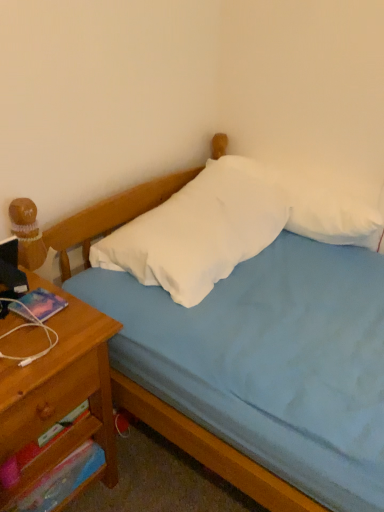
Question: From the image's perspective, is wooden drawer at left, the second drawer when ordered from bottom to top, below light blue fabric bed at center?

Choices:
 (A) no
 (B) yes

Answer: (B)

Question: Is light blue fabric bed at center inside wooden drawer at left, acting as the first drawer starting from the top?

Choices:
 (A) no
 (B) yes

Answer: (A)

Question: Is wooden drawer at left, the second drawer when ordered from bottom to top, beside light blue fabric bed at center?

Choices:
 (A) no
 (B) yes

Answer: (A)

Question: Is the depth of wooden drawer at left, the second drawer when ordered from bottom to top, less than that of light blue fabric bed at center?

Choices:
 (A) yes
 (B) no

Answer: (B)

Question: Is wooden drawer at left, acting as the first drawer starting from the top, shorter than light blue fabric bed at center?

Choices:
 (A) yes
 (B) no

Answer: (A)

Question: Does point (43, 388) appear closer or farther from the camera than point (87, 338)?

Choices:
 (A) closer
 (B) farther

Answer: (A)

Question: Considering their positions, is wooden drawer at left, the second drawer when ordered from bottom to top, located in front of or behind wooden nightstand at left?

Choices:
 (A) front
 (B) behind

Answer: (B)

Question: Considering the positions of wooden drawer at left, acting as the first drawer starting from the top, and wooden nightstand at left in the image, is wooden drawer at left, acting as the first drawer starting from the top, taller or shorter than wooden nightstand at left?

Choices:
 (A) short
 (B) tall

Answer: (A)

Question: From a real-world perspective, is wooden drawer at left, the second drawer when ordered from bottom to top, physically located above or below wooden nightstand at left?

Choices:
 (A) above
 (B) below

Answer: (A)

Question: Is wooden drawer at left, the second drawer when ordered from bottom to top, inside the boundaries of white soft pillow at center, which is the second pillow from right to left, or outside?

Choices:
 (A) inside
 (B) outside

Answer: (B)

Question: In the image, is wooden drawer at left, acting as the first drawer starting from the top, positioned in front of or behind white soft pillow at center, which is the second pillow from right to left?

Choices:
 (A) front
 (B) behind

Answer: (A)

Question: Considering the relative positions of wooden drawer at left, acting as the first drawer starting from the top, and white soft pillow at center, the 1th pillow viewed from the left, in the image provided, is wooden drawer at left, acting as the first drawer starting from the top, to the left or to the right of white soft pillow at center, the 1th pillow viewed from the left,?

Choices:
 (A) left
 (B) right

Answer: (A)

Question: Looking at the image, does wooden drawer at left, acting as the first drawer starting from the top, seem bigger or smaller compared to white soft pillow at center, the 1th pillow viewed from the left?

Choices:
 (A) small
 (B) big

Answer: (A)

Question: Relative to wooden drawer at left, acting as the first drawer starting from the top, is white soft pillow at upper right, the 1th pillow when ordered from right to left, in front or behind?

Choices:
 (A) behind
 (B) front

Answer: (A)

Question: Looking at the image, does white soft pillow at upper right, the 1th pillow when ordered from right to left, seem bigger or smaller compared to wooden drawer at left, acting as the first drawer starting from the top?

Choices:
 (A) big
 (B) small

Answer: (A)